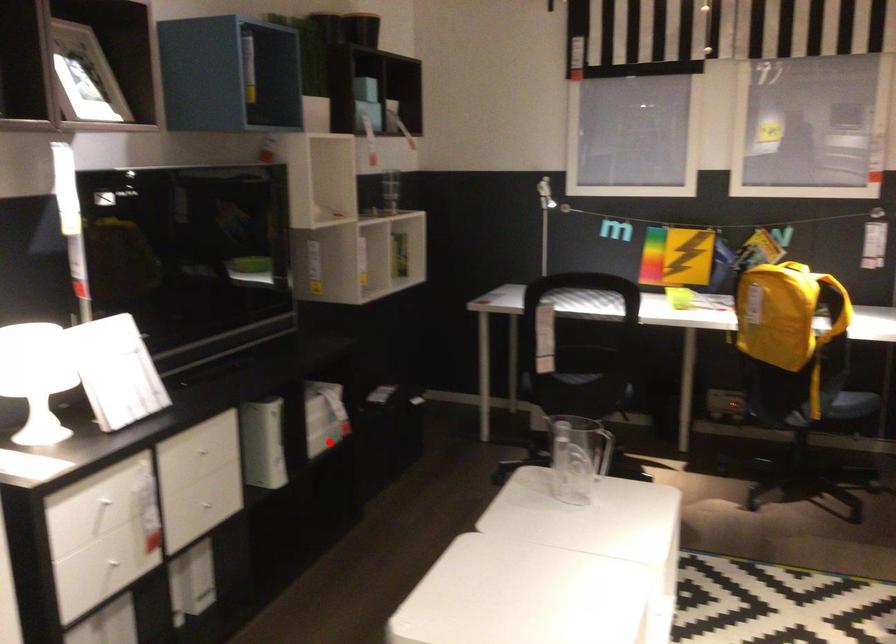
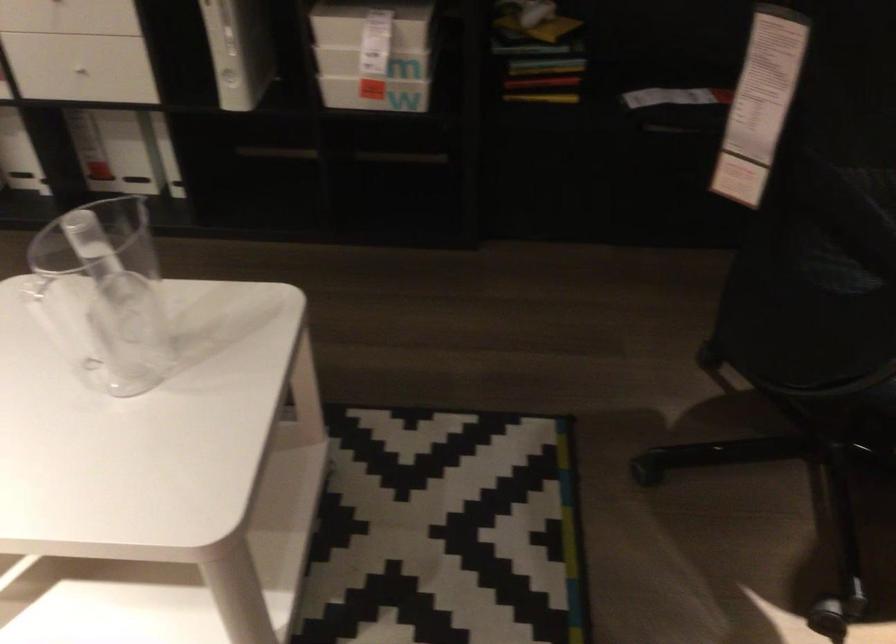
Question: I am providing you with two images of the same scene from different viewpoints. A red point is shown in image1. For the corresponding object point in image2, is it positioned nearer or farther from the camera?

Choices:
 (A) Nearer
 (B) Farther

Answer: (A)